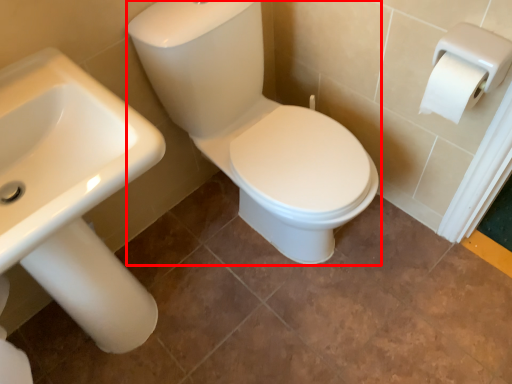
Question: Observing the image, what is the correct spatial positioning of sit (annotated by the red box) in reference to sink?

Choices:
 (A) right
 (B) left

Answer: (A)